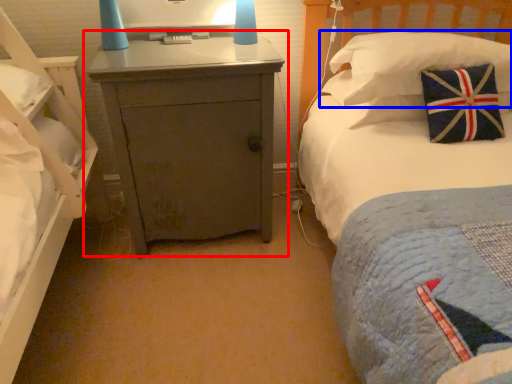
Question: Which point is further to the camera, nightstand (highlighted by a red box) or pillow (highlighted by a blue box)?

Choices:
 (A) nightstand
 (B) pillow

Answer: (B)